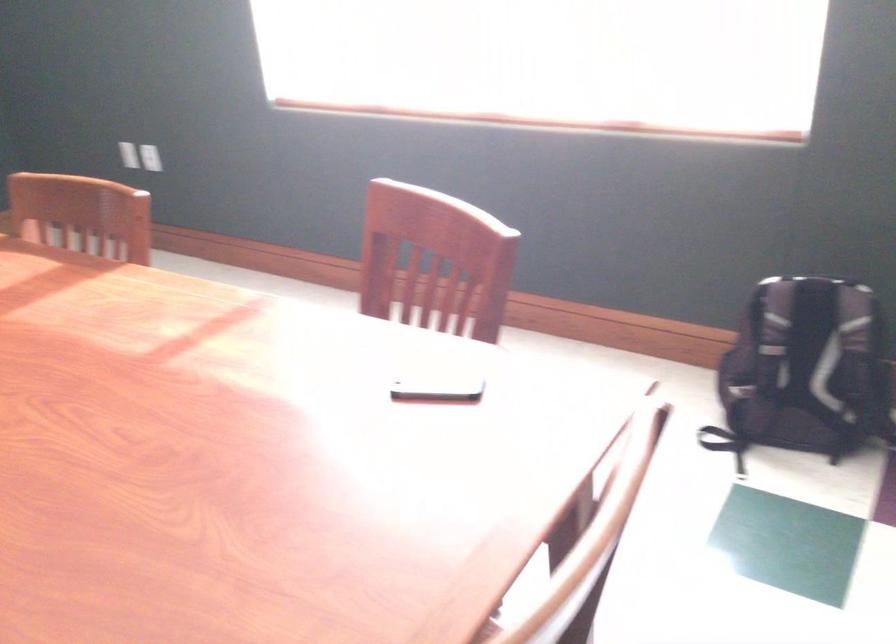
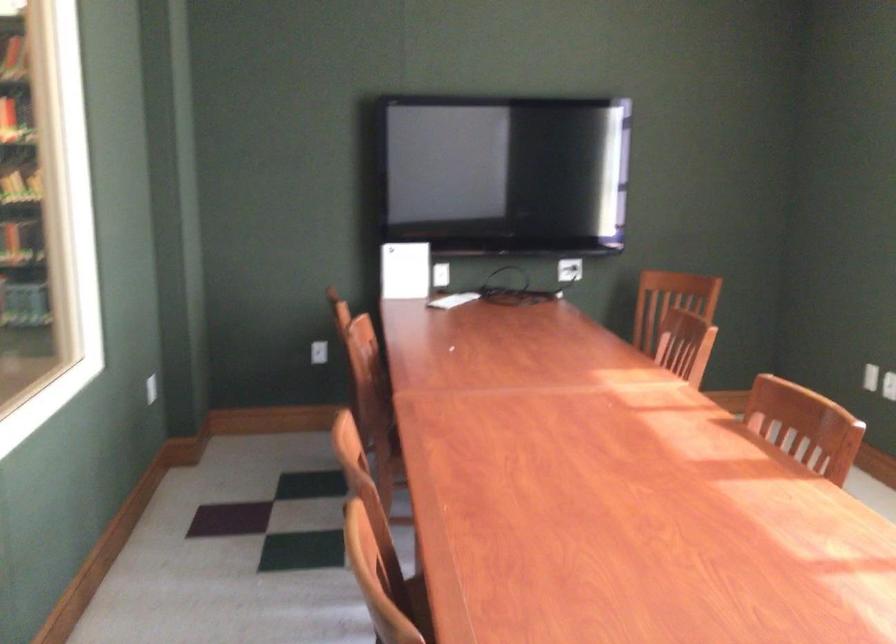
Question: How did the camera likely rotate?

Choices:
 (A) Left
 (B) Right
 (C) Up
 (D) Down

Answer: (A)